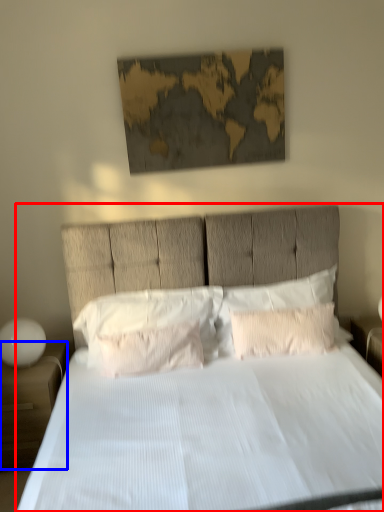
Question: Which point is closer to the camera, bed (highlighted by a red box) or nightstand (highlighted by a blue box)?

Choices:
 (A) bed
 (B) nightstand

Answer: (A)